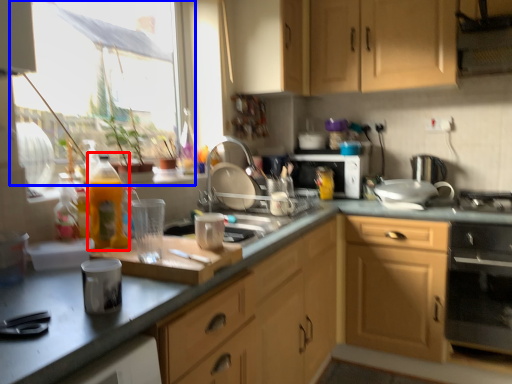
Question: Which object is further to the camera taking this photo, bottle (highlighted by a red box) or window (highlighted by a blue box)?

Choices:
 (A) bottle
 (B) window

Answer: (B)